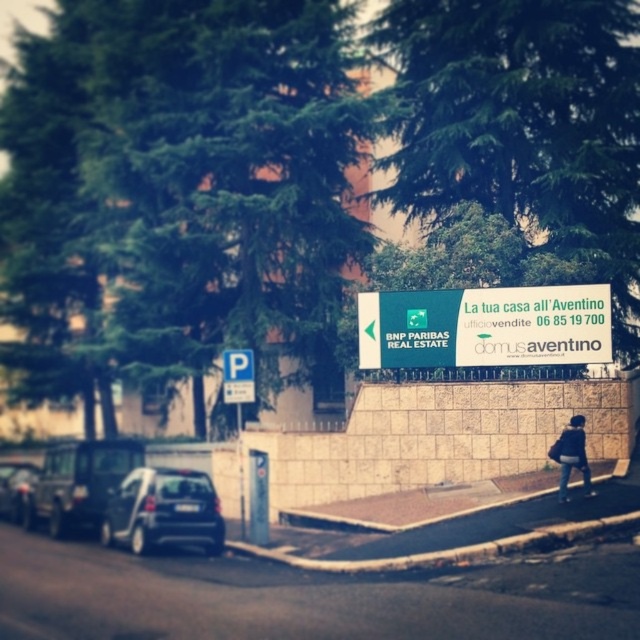
Question: Considering the relative positions of black matte car at left and blue plastic parking sign at lower left in the image provided, where is black matte car at left located with respect to blue plastic parking sign at lower left?

Choices:
 (A) left
 (B) right

Answer: (A)

Question: Which point is closer to the camera?

Choices:
 (A) green leafy tree at upper center
 (B) black matte car at left

Answer: (B)

Question: Can you confirm if black matte car at left is smaller than dark blue jeans at lower right?

Choices:
 (A) no
 (B) yes

Answer: (A)

Question: Which of the following is the closest to the observer?

Choices:
 (A) (412, 291)
 (B) (83, 506)

Answer: (B)

Question: Is dark gray metallic car at left below blue plastic parking sign at lower left?

Choices:
 (A) yes
 (B) no

Answer: (A)

Question: Which of the following is the farthest from the observer?

Choices:
 (A) (273, 218)
 (B) (19, 512)
 (C) (56, 474)
 (D) (243, 387)

Answer: (A)